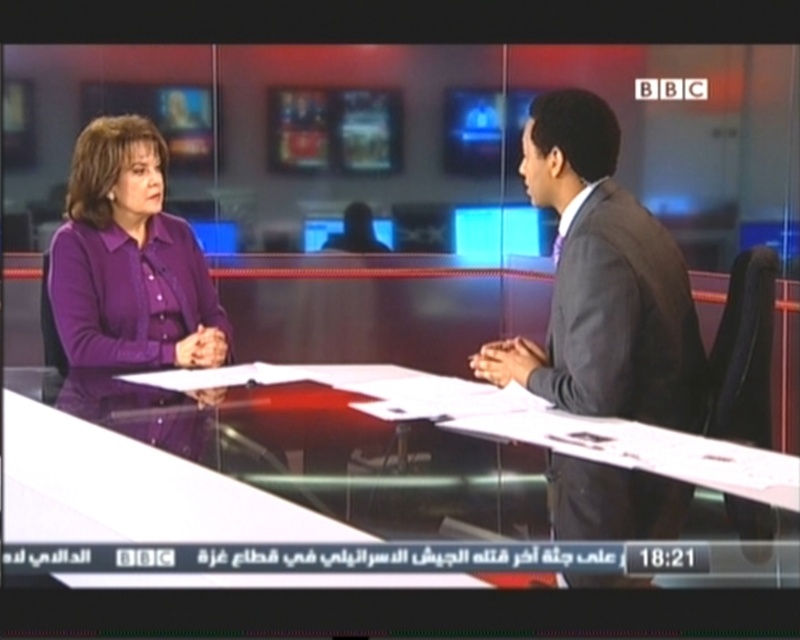
Describe the element at coordinates (328, 490) in the screenshot. The width and height of the screenshot is (800, 640). I see `transparent glass table at center` at that location.

How distant is transparent glass table at center from purple button-down shirt at left?

transparent glass table at center is 20.91 inches away from purple button-down shirt at left.

This screenshot has width=800, height=640. Find the location of `transparent glass table at center`. transparent glass table at center is located at coordinates (328, 490).

Does transparent glass table at center have a lesser width compared to dark gray suit at right?

Incorrect, transparent glass table at center's width is not less than dark gray suit at right's.

Can you confirm if transparent glass table at center is positioned to the right of dark gray suit at right?

In fact, transparent glass table at center is to the left of dark gray suit at right.

Is point (617, 570) behind point (605, 490)?

No.

At what (x,y) coordinates should I click in order to perform the action: click on transparent glass table at center. Please return your answer as a coordinate pair (x, y). This screenshot has width=800, height=640. Looking at the image, I should click on (328, 490).

Can you confirm if dark gray suit at right is positioned below purple button-down shirt at left?

Yes.

Is dark gray suit at right closer to camera compared to purple button-down shirt at left?

Yes, dark gray suit at right is in front of purple button-down shirt at left.

Is point (568, 208) more distant than point (100, 138)?

No.

The image size is (800, 640). Identify the location of dark gray suit at right. (602, 282).